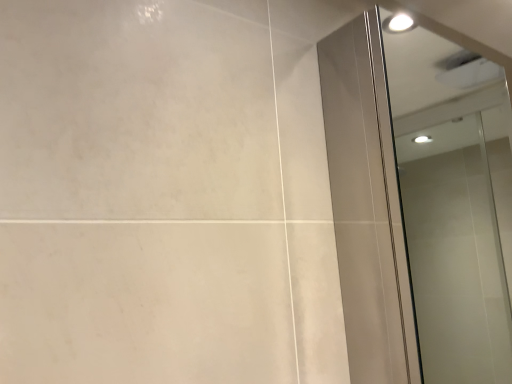
Find the location of a particular element. clear glass mirror at right is located at coordinates (454, 203).

The image size is (512, 384). Describe the element at coordinates (454, 203) in the screenshot. I see `clear glass mirror at right` at that location.

What is the approximate height of clear glass mirror at right?

It is 27.70 inches.

Where is `clear glass mirror at right`? Image resolution: width=512 pixels, height=384 pixels. clear glass mirror at right is located at coordinates (454, 203).